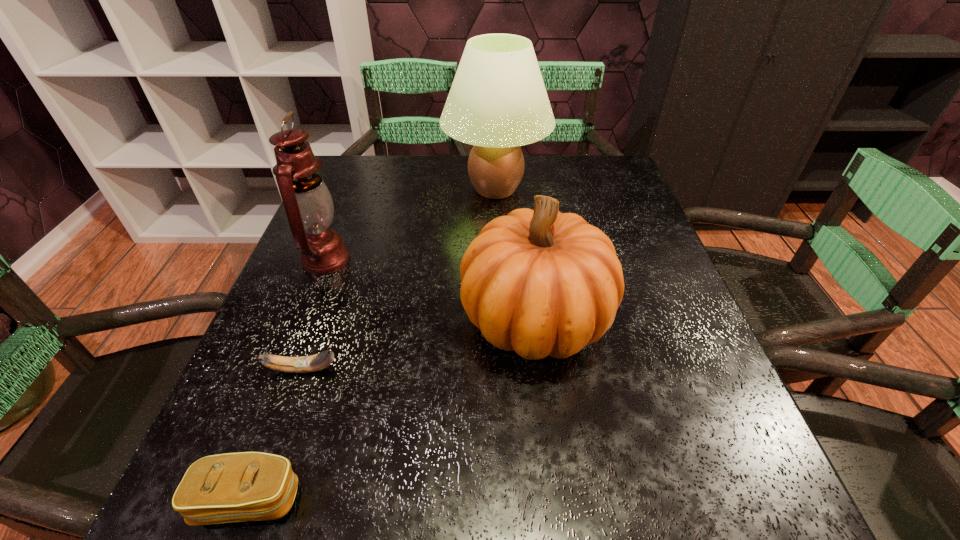
The image size is (960, 540). I want to click on the farthest object, so click(x=497, y=102).

The image size is (960, 540). I want to click on oil lamp, so click(308, 204).

Locate an element on the screen. This screenshot has height=540, width=960. the third shortest object is located at coordinates (539, 282).

Find the location of `banana`. banana is located at coordinates (303, 364).

In order to click on clutch bag in this screenshot , I will do `click(248, 486)`.

The image size is (960, 540). In order to click on free space located 0.270m on the shade of the farthest object in this screenshot , I will do coord(341,189).

Locate an element on the screen. Image resolution: width=960 pixels, height=540 pixels. blank space located 0.160m on the shade of the farthest object is located at coordinates (382, 189).

At what (x,y) coordinates should I click in order to perform the action: click on vacant area situated on the shade of the farthest object. Please return your answer as a coordinate pair (x, y). Looking at the image, I should click on (367, 189).

The width and height of the screenshot is (960, 540). I want to click on free space located on the back of the oil lamp, so click(341, 222).

The image size is (960, 540). Find the location of `vacant space located 0.050m on the right of the pumpkin`. vacant space located 0.050m on the right of the pumpkin is located at coordinates (636, 319).